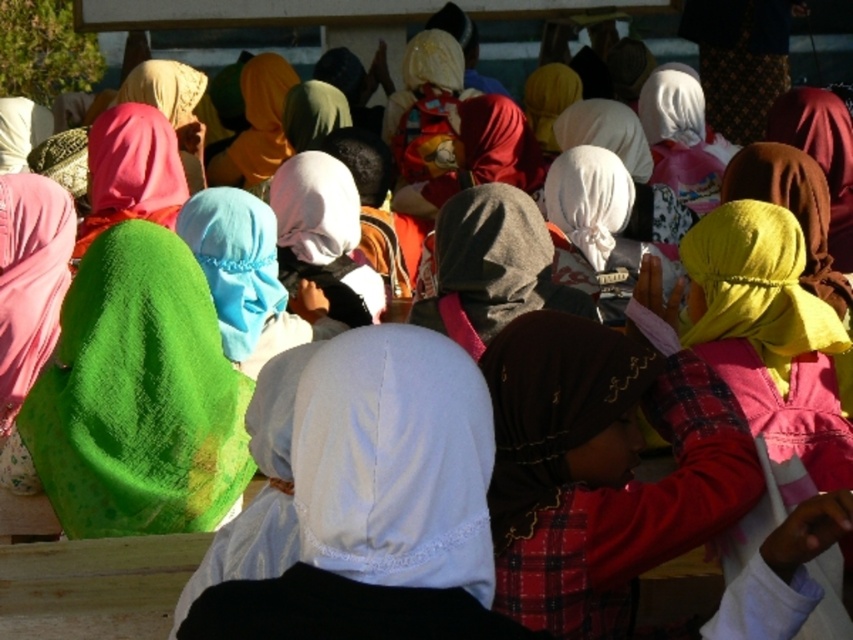
Question: Can you confirm if yellow fabric headscarf at right is thinner than white satin headscarf at center?

Choices:
 (A) no
 (B) yes

Answer: (A)

Question: Is white satin hijab at center positioned behind yellow fabric headscarf at right?

Choices:
 (A) no
 (B) yes

Answer: (A)

Question: Which point is closer to the camera?

Choices:
 (A) green textured scarf at center-left
 (B) white satin headscarf at center
 (C) white satin hijab at center

Answer: (C)

Question: Where is green textured scarf at center-left located in relation to yellow fabric headscarf at right in the image?

Choices:
 (A) left
 (B) right

Answer: (A)

Question: Which of the following is the closest to the observer?

Choices:
 (A) (x=212, y=362)
 (B) (x=576, y=198)
 (C) (x=822, y=328)
 (D) (x=439, y=387)

Answer: (D)

Question: Which of the following is the farthest from the observer?

Choices:
 (A) (589, 257)
 (B) (434, 480)
 (C) (102, 250)
 (D) (730, 307)

Answer: (A)